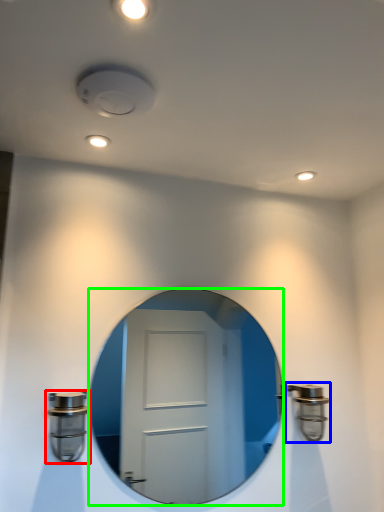
Question: Considering the real-world distances, which object is farthest from door handle (highlighted by a red box)? door handle (highlighted by a blue box) or mirror (highlighted by a green box)?

Choices:
 (A) door handle
 (B) mirror

Answer: (B)